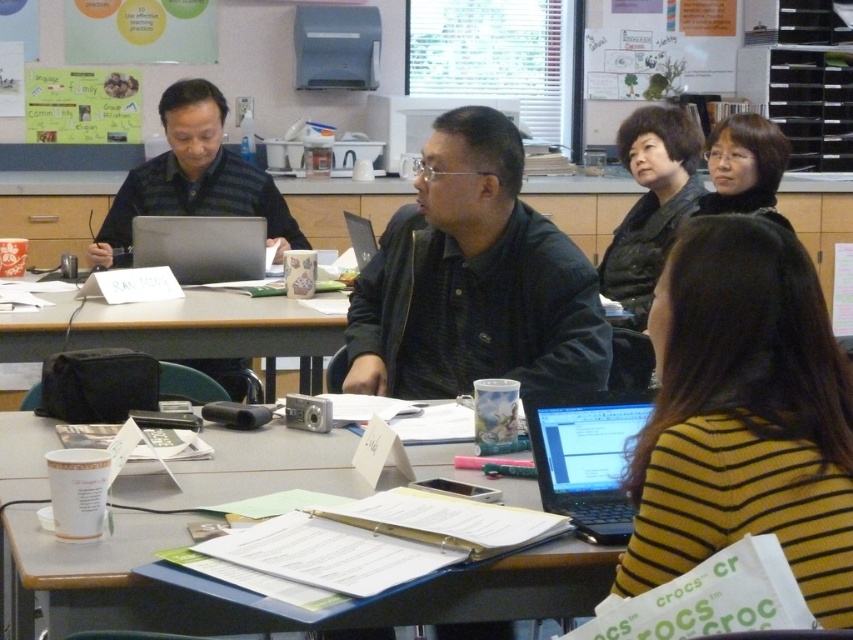
Looking at this image, you are standing at the back of the room and want to see the white paperboard at upper center. Is the black matte shirt at center blocking your view of it?

The black matte shirt at center is not as tall as the white paperboard at upper center, so it might not fully block the view. However, since the shirt is at the center and the paperboard is at upper center, there could still be some obstruction depending on the exact positions.

You are standing at the center of the room and want to pick up the yellow striped sweater at lower right. Based on its coordinates, in which general direction should you move to reach it?

The yellow striped sweater at lower right is located at coordinates point (743, 417), so you should move towards the lower right direction to reach it.